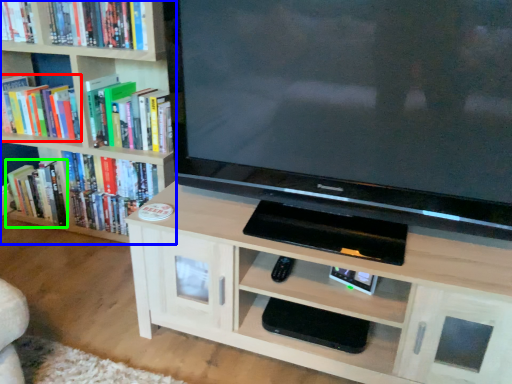
Question: Estimate the real-world distances between objects in this image. Which object is closer to book (highlighted by a red box), bookcase (highlighted by a blue box) or book (highlighted by a green box)?

Choices:
 (A) bookcase
 (B) book

Answer: (A)